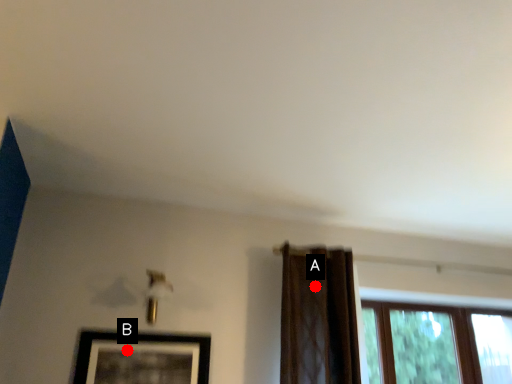
Question: Two points are circled on the image, labeled by A and B beside each circle. Among these points, which one is farthest from the camera?

Choices:
 (A) A is further
 (B) B is further

Answer: (A)